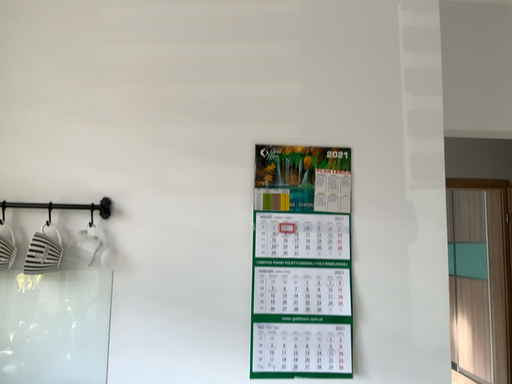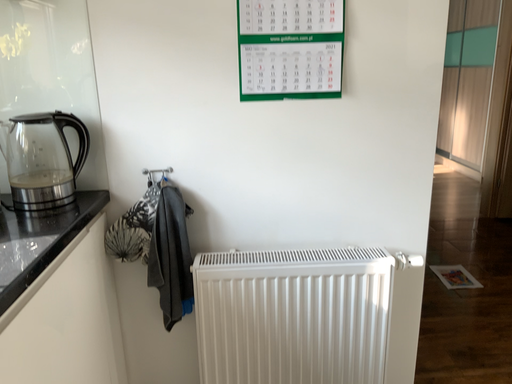
Question: Which way did the camera rotate in the video?

Choices:
 (A) rotated upward
 (B) rotated downward

Answer: (B)